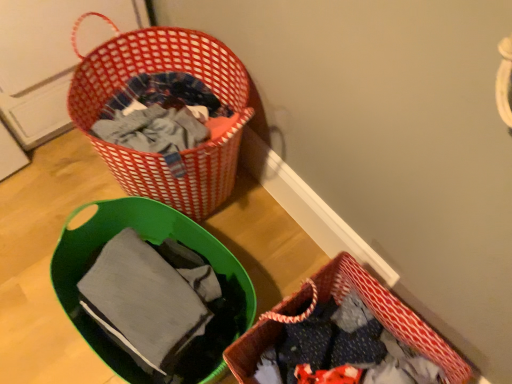
Question: Is red woven basket at upper left, the first picnic basket when ordered from top to bottom, at the left side of red woven picnic basket at lower right, arranged as the 2th picnic basket when viewed from the left?

Choices:
 (A) no
 (B) yes

Answer: (B)

Question: Does red woven basket at upper left, the first picnic basket when ordered from top to bottom, have a lesser height compared to red woven picnic basket at lower right, which ranks as the 2th picnic basket in top-to-bottom order?

Choices:
 (A) no
 (B) yes

Answer: (A)

Question: Is red woven basket at upper left, placed as the first picnic basket when sorted from left to right, to the right of red woven picnic basket at lower right, which ranks as the 2th picnic basket in top-to-bottom order, from the viewer's perspective?

Choices:
 (A) yes
 (B) no

Answer: (B)

Question: Is red woven picnic basket at lower right, arranged as the 2th picnic basket when viewed from the left, located within red woven basket at upper left, the second picnic basket viewed from the right?

Choices:
 (A) no
 (B) yes

Answer: (A)

Question: Is red woven basket at upper left, the second picnic basket viewed from the right, oriented towards red woven picnic basket at lower right, arranged as the 2th picnic basket when viewed from the left?

Choices:
 (A) yes
 (B) no

Answer: (B)

Question: Is red woven basket at upper left, placed as the first picnic basket when sorted from left to right, wider or thinner than red woven picnic basket at lower right, arranged as the first picnic basket when viewed from the right?

Choices:
 (A) thin
 (B) wide

Answer: (B)

Question: Does point (111, 150) appear closer or farther from the camera than point (379, 289)?

Choices:
 (A) farther
 (B) closer

Answer: (A)

Question: Visually, is red woven basket at upper left, the 2th picnic basket ordered from the bottom, positioned to the left or to the right of red woven picnic basket at lower right, arranged as the 2th picnic basket when viewed from the left?

Choices:
 (A) right
 (B) left

Answer: (B)

Question: Is red woven basket at upper left, placed as the first picnic basket when sorted from left to right, bigger or smaller than red woven picnic basket at lower right, which is counted as the first picnic basket, starting from the bottom?

Choices:
 (A) small
 (B) big

Answer: (B)

Question: Considering their positions, is matte gray fabric at lower left located in front of or behind red woven picnic basket at lower right, arranged as the 2th picnic basket when viewed from the left?

Choices:
 (A) front
 (B) behind

Answer: (B)

Question: Is matte gray fabric at lower left to the left or to the right of red woven picnic basket at lower right, which ranks as the 2th picnic basket in top-to-bottom order, in the image?

Choices:
 (A) left
 (B) right

Answer: (A)

Question: From a real-world perspective, relative to red woven picnic basket at lower right, which ranks as the 2th picnic basket in top-to-bottom order, is matte gray fabric at lower left vertically above or below?

Choices:
 (A) below
 (B) above

Answer: (B)

Question: Is matte gray fabric at lower left bigger or smaller than red woven picnic basket at lower right, which is counted as the first picnic basket, starting from the bottom?

Choices:
 (A) big
 (B) small

Answer: (B)

Question: From the image's perspective, is matte gray fabric at lower left located above or below red woven basket at upper left, the second picnic basket viewed from the right?

Choices:
 (A) above
 (B) below

Answer: (B)

Question: Considering the positions of matte gray fabric at lower left and red woven basket at upper left, the first picnic basket when ordered from top to bottom, in the image, is matte gray fabric at lower left wider or thinner than red woven basket at upper left, the first picnic basket when ordered from top to bottom,?

Choices:
 (A) thin
 (B) wide

Answer: (A)